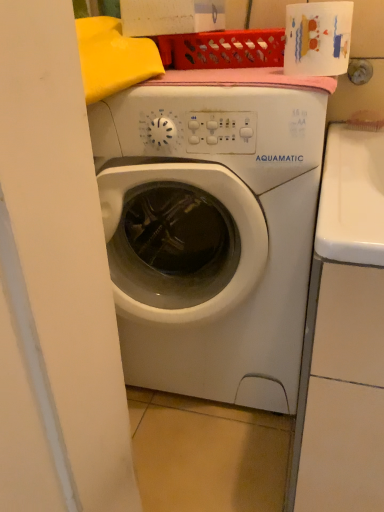
Question: From the image's perspective, is white glossy toilet paper at upper right located above or below white matte washing machine at center?

Choices:
 (A) above
 (B) below

Answer: (A)

Question: Looking at their shapes, would you say white glossy toilet paper at upper right is wider or thinner than white matte washing machine at center?

Choices:
 (A) thin
 (B) wide

Answer: (A)

Question: Does point (329, 51) appear closer or farther from the camera than point (200, 327)?

Choices:
 (A) farther
 (B) closer

Answer: (B)

Question: Based on their sizes in the image, would you say white matte washing machine at center is bigger or smaller than white glossy toilet paper at upper right?

Choices:
 (A) big
 (B) small

Answer: (A)

Question: Is white matte washing machine at center spatially inside white glossy toilet paper at upper right, or outside of it?

Choices:
 (A) inside
 (B) outside

Answer: (B)

Question: From a real-world perspective, is white matte washing machine at center above or below white glossy toilet paper at upper right?

Choices:
 (A) above
 (B) below

Answer: (B)

Question: Does point (109, 195) appear closer or farther from the camera than point (319, 27)?

Choices:
 (A) farther
 (B) closer

Answer: (A)